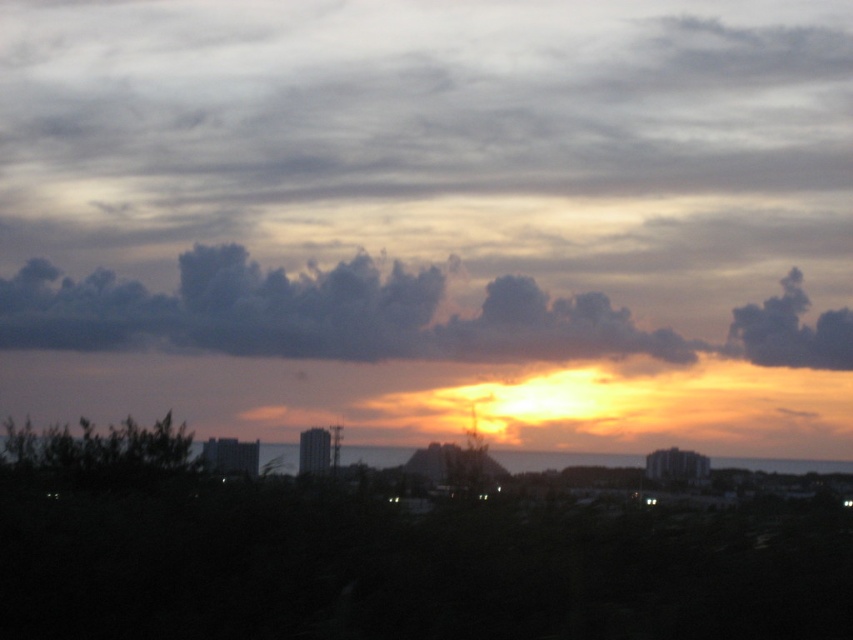
Question: Which point appears closest to the camera in this image?

Choices:
 (A) (491, 144)
 (B) (305, 276)

Answer: (B)

Question: Can you confirm if gray/cloudy sky at upper is bigger than dark gray fluffy clouds at upper center?

Choices:
 (A) yes
 (B) no

Answer: (A)

Question: Does gray/cloudy sky at upper have a lesser width compared to dark gray fluffy clouds at upper center?

Choices:
 (A) yes
 (B) no

Answer: (B)

Question: Can you confirm if gray/cloudy sky at upper is positioned above dark gray fluffy clouds at upper center?

Choices:
 (A) yes
 (B) no

Answer: (A)

Question: Which point is farther to the camera?

Choices:
 (A) gray/cloudy sky at upper
 (B) dark gray fluffy clouds at upper center

Answer: (B)